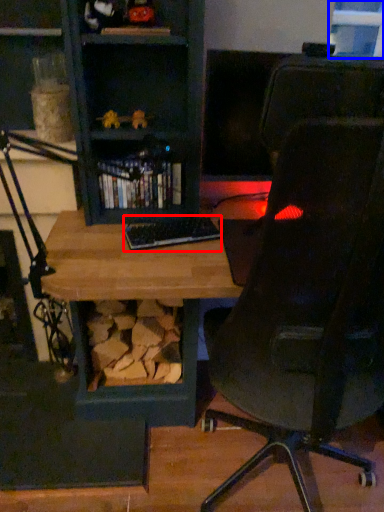
Question: Which object appears farthest to the camera in this image, keyboard (highlighted by a red box) or window (highlighted by a blue box)?

Choices:
 (A) keyboard
 (B) window

Answer: (B)